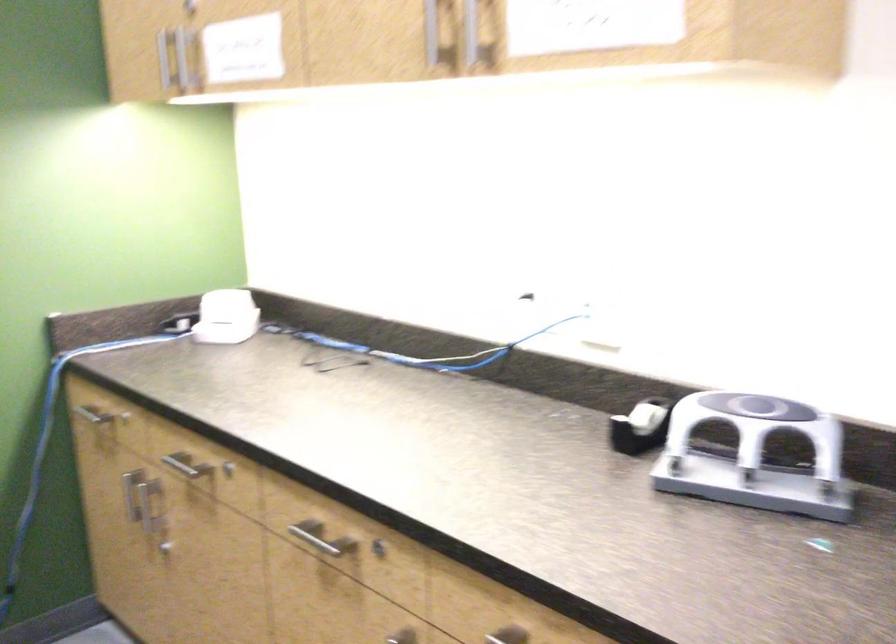
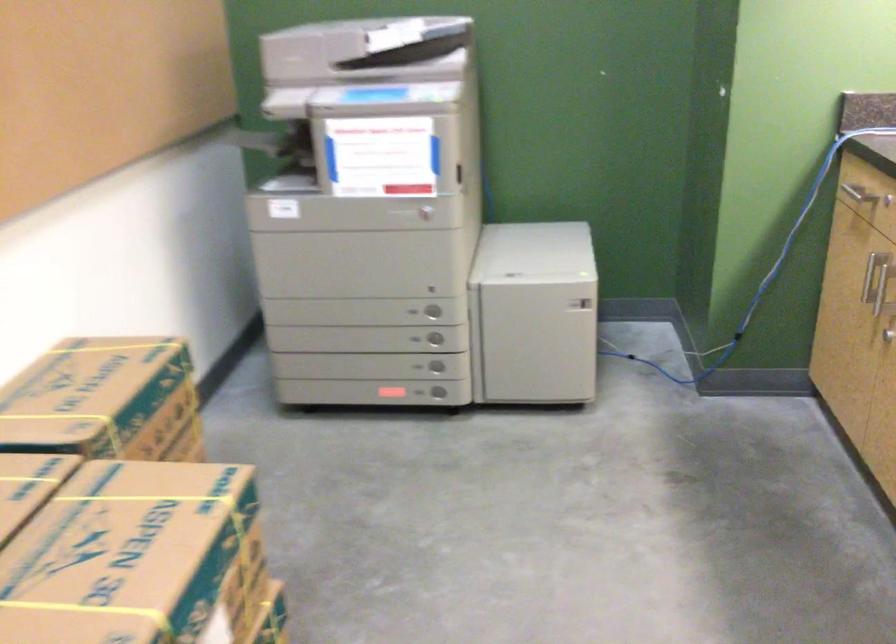
Question: The camera is either moving clockwise (left) or counter-clockwise (right) around the object. The first image is from the beginning of the video and the second image is from the end. Is the camera moving left or right when shooting the video?

Choices:
 (A) Left
 (B) Right

Answer: (B)